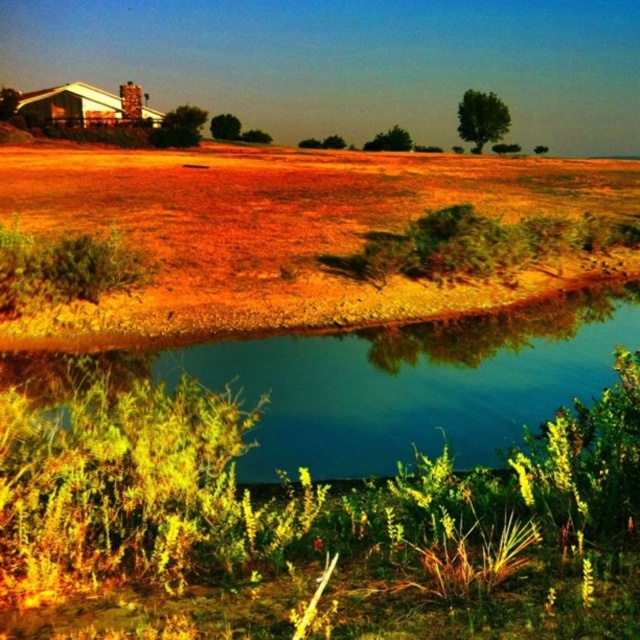
You are a photographer aiming to capture the dried grass at center and the green reflective water at center in a single frame. Which object will appear larger in your photo?

The dried grass at center will appear larger in the photo because it is bigger than the green reflective water at center.

You are standing in the landscape and want to take a photo of the dried grass at center and the green reflective water at center. Which object should you focus on first if you want both to be in sharp focus?

You should focus on the dried grass at center first because it is closer to you than the green reflective water at center, so focusing on the closer object will ensure both are in focus.